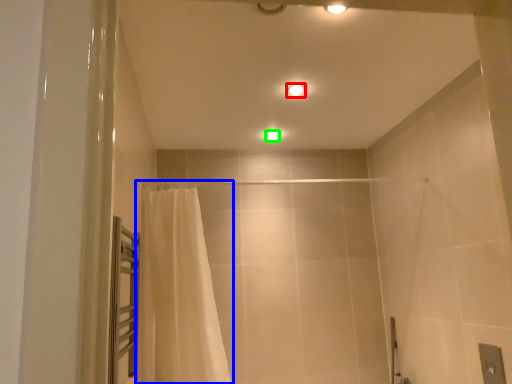
Question: Which is farther away from light fixture (highlighted by a red box)? curtain (highlighted by a blue box) or light fixture (highlighted by a green box)?

Choices:
 (A) curtain
 (B) light fixture

Answer: (A)